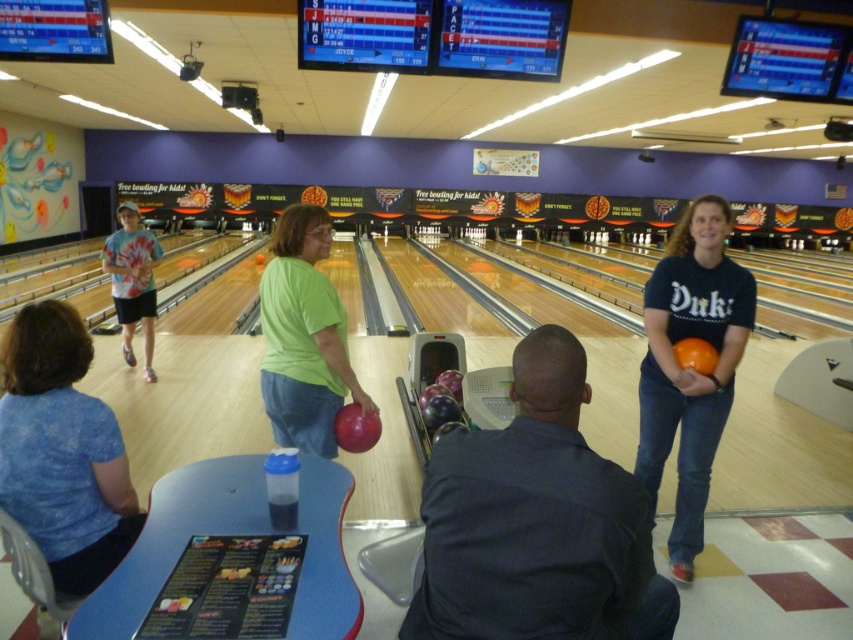
You are standing at the entrance of the bowling alley and see two people wearing blue shirts. The first is wearing a dark blue shirt at center and the second is wearing a blue fabric shirt at lower left. Which person is closer to the entrance?

The dark blue shirt at center is below the blue fabric shirt at lower left, so the blue fabric shirt at lower left is closer to the entrance.

You are standing at the entrance of the bowling alley and want to take a photo of the two points marked in the image. Which point, point (326,449) or point (138,291), will appear larger in your photo?

Point (326,449) is closer to the camera than point (138,291), so it will appear larger in the photo.